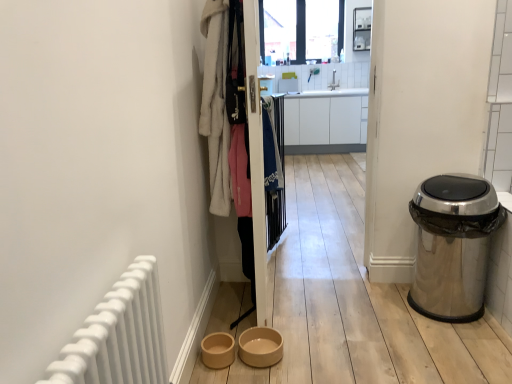
Question: Is beige ceramic bowl at lower center, which is the second toilet bowl from left to right, turned away from transparent glass window at upper center?

Choices:
 (A) yes
 (B) no

Answer: (B)

Question: Is beige ceramic bowl at lower center, which is the second toilet bowl from left to right, smaller than transparent glass window at upper center?

Choices:
 (A) yes
 (B) no

Answer: (A)

Question: From the image's perspective, is beige ceramic bowl at lower center, which appears as the first toilet bowl when viewed from the right, below transparent glass window at upper center?

Choices:
 (A) no
 (B) yes

Answer: (B)

Question: Is beige ceramic bowl at lower center, which is the second toilet bowl from left to right, shorter than transparent glass window at upper center?

Choices:
 (A) yes
 (B) no

Answer: (A)

Question: Is beige ceramic bowl at lower center, which is the second toilet bowl from left to right, positioned far away from transparent glass window at upper center?

Choices:
 (A) yes
 (B) no

Answer: (A)

Question: Does point (272, 190) appear closer or farther from the camera than point (260, 254)?

Choices:
 (A) farther
 (B) closer

Answer: (A)

Question: From their relative heights in the image, would you say blue fabric at center, marked as the second clothing in a left-to-right arrangement, is taller or shorter than wooden screen door at center?

Choices:
 (A) short
 (B) tall

Answer: (A)

Question: Is blue fabric at center, which is the 1th clothing from back to front, spatially inside wooden screen door at center, or outside of it?

Choices:
 (A) inside
 (B) outside

Answer: (B)

Question: From the image's perspective, relative to wooden screen door at center, is blue fabric at center, which is the 1th clothing from back to front, above or below?

Choices:
 (A) above
 (B) below

Answer: (A)

Question: Looking at the image, does white fluffy bathrobe at upper left, which is counted as the second clothing, starting from the back, seem bigger or smaller compared to white matte radiator at left?

Choices:
 (A) small
 (B) big

Answer: (B)

Question: Relative to white matte radiator at left, is white fluffy bathrobe at upper left, placed as the 1th clothing when sorted from left to right, in front or behind?

Choices:
 (A) front
 (B) behind

Answer: (B)

Question: Considering the relative positions of white fluffy bathrobe at upper left, placed as the 1th clothing when sorted from left to right, and white matte radiator at left in the image provided, is white fluffy bathrobe at upper left, placed as the 1th clothing when sorted from left to right, to the left or to the right of white matte radiator at left?

Choices:
 (A) left
 (B) right

Answer: (B)

Question: In terms of height, does white fluffy bathrobe at upper left, the first clothing in the front-to-back sequence, look taller or shorter compared to white matte radiator at left?

Choices:
 (A) short
 (B) tall

Answer: (B)

Question: From their relative heights in the image, would you say blue fabric at center, which is the 2th clothing from front to back, is taller or shorter than polished stainless steel trash can at right?

Choices:
 (A) tall
 (B) short

Answer: (B)

Question: Is point (275, 158) positioned closer to the camera than point (462, 235)?

Choices:
 (A) farther
 (B) closer

Answer: (A)